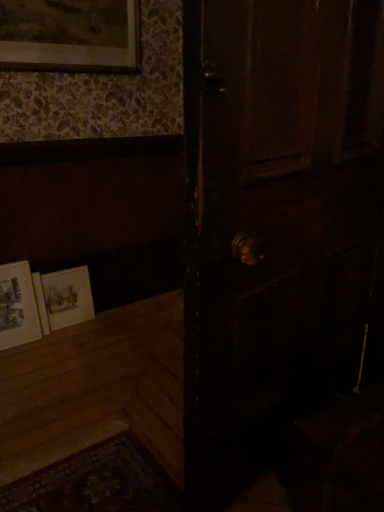
Question: From the image's perspective, would you say matte gold picture frame at upper left, the 3th picture frame from the bottom, is shown under matte paper picture frame at lower left, the 1th picture frame in the bottom-to-top sequence?

Choices:
 (A) yes
 (B) no

Answer: (B)

Question: Does matte gold picture frame at upper left, the 3th picture frame from the bottom, come in front of matte paper picture frame at lower left, which is the third picture frame from top to bottom?

Choices:
 (A) no
 (B) yes

Answer: (B)

Question: Is matte paper picture frame at lower left, the 1th picture frame in the bottom-to-top sequence, at the back of matte gold picture frame at upper left, which is the 1th picture frame from top to bottom?

Choices:
 (A) yes
 (B) no

Answer: (B)

Question: Is matte gold picture frame at upper left, which is the 1th picture frame from top to bottom, wider than matte paper picture frame at lower left, which is the third picture frame from top to bottom?

Choices:
 (A) yes
 (B) no

Answer: (B)

Question: Is matte paper picture frame at lower left, the 1th picture frame in the bottom-to-top sequence, located within matte gold picture frame at upper left, which is the 1th picture frame from top to bottom?

Choices:
 (A) yes
 (B) no

Answer: (B)

Question: Looking at the image, does matte white picture frame at lower left, the second picture frame in the bottom-to-top sequence, seem bigger or smaller compared to dark wood door at center?

Choices:
 (A) small
 (B) big

Answer: (A)

Question: From the image's perspective, is matte white picture frame at lower left, arranged as the 2th picture frame when viewed from the top, located above or below dark wood door at center?

Choices:
 (A) above
 (B) below

Answer: (B)

Question: In the image, is matte white picture frame at lower left, the second picture frame in the bottom-to-top sequence, positioned in front of or behind dark wood door at center?

Choices:
 (A) front
 (B) behind

Answer: (B)

Question: From a real-world perspective, relative to dark wood door at center, is matte white picture frame at lower left, arranged as the 2th picture frame when viewed from the top, vertically above or below?

Choices:
 (A) below
 (B) above

Answer: (A)

Question: Based on their positions, is matte white picture frame at lower left, the second picture frame in the bottom-to-top sequence, located to the left or right of matte paper picture frame at lower left, which is the third picture frame from top to bottom?

Choices:
 (A) right
 (B) left

Answer: (A)

Question: Is matte white picture frame at lower left, arranged as the 2th picture frame when viewed from the top, situated inside matte paper picture frame at lower left, which is the third picture frame from top to bottom, or outside?

Choices:
 (A) inside
 (B) outside

Answer: (B)

Question: In terms of height, does matte white picture frame at lower left, the second picture frame in the bottom-to-top sequence, look taller or shorter compared to matte paper picture frame at lower left, the 1th picture frame in the bottom-to-top sequence?

Choices:
 (A) tall
 (B) short

Answer: (B)

Question: Is point (56, 323) positioned closer to the camera than point (16, 286)?

Choices:
 (A) closer
 (B) farther

Answer: (B)

Question: Based on their sizes in the image, would you say matte paper picture frame at lower left, which is the third picture frame from top to bottom, is bigger or smaller than matte white picture frame at lower left, the second picture frame in the bottom-to-top sequence?

Choices:
 (A) small
 (B) big

Answer: (B)

Question: Considering the positions of point coord(13,315) and point coord(67,276), is point coord(13,315) closer or farther from the camera than point coord(67,276)?

Choices:
 (A) farther
 (B) closer

Answer: (B)